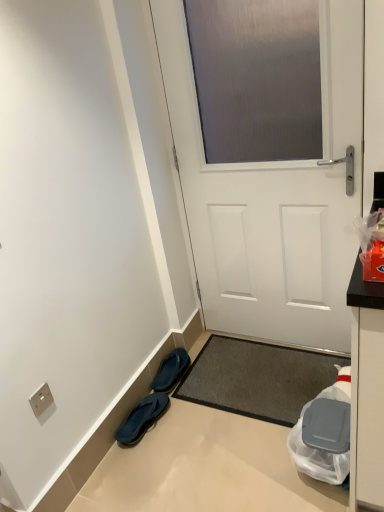
Image resolution: width=384 pixels, height=512 pixels. I want to click on free space in front of blue rubber flip-flops at lower left, arranged as the first footwear when viewed from the back, so click(187, 402).